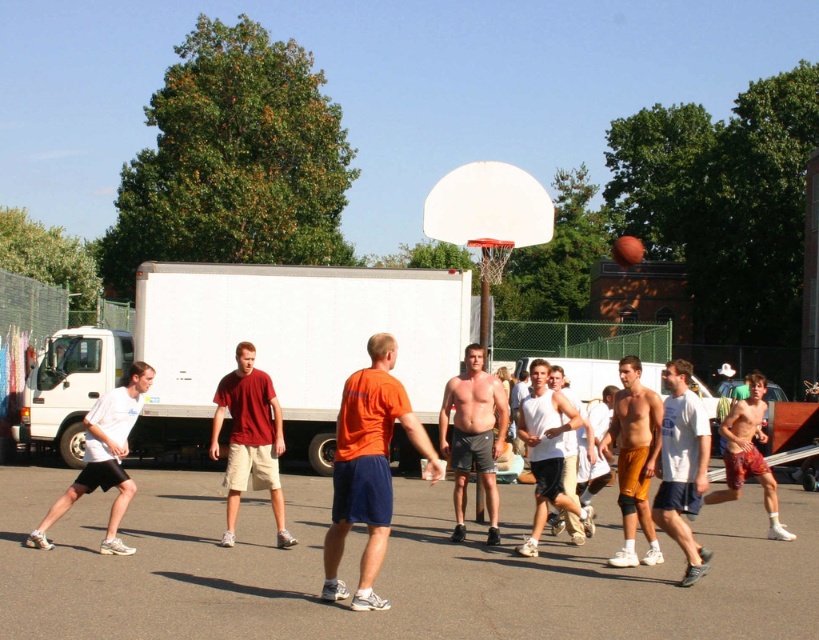
Question: Is maroon cotton t-shirt at center smaller than orange shorts at center?

Choices:
 (A) no
 (B) yes

Answer: (A)

Question: Observing the image, what is the correct spatial positioning of white matte truck at center in reference to orange shorts at center?

Choices:
 (A) right
 (B) left

Answer: (B)

Question: Among these points, which one is farthest from the camera?

Choices:
 (A) (632, 250)
 (B) (96, 483)
 (C) (247, 388)

Answer: (A)

Question: Is orange shorts at center wider than white matte tank top at center?

Choices:
 (A) no
 (B) yes

Answer: (A)

Question: Which point appears closest to the camera in this image?

Choices:
 (A) (446, 236)
 (B) (637, 438)
 (C) (61, 582)
 (D) (234, 336)

Answer: (C)

Question: Which object is positioned closest to the orange matte basketball at center?

Choices:
 (A) smooth asphalt court at center
 (B) white cotton t-shirt at center
 (C) white matte truck at center

Answer: (A)